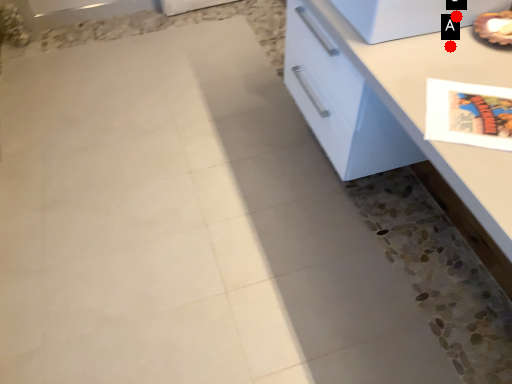
Question: Two points are circled on the image, labeled by A and B beside each circle. Which point is farther from the camera taking this photo?

Choices:
 (A) A is further
 (B) B is further

Answer: (B)